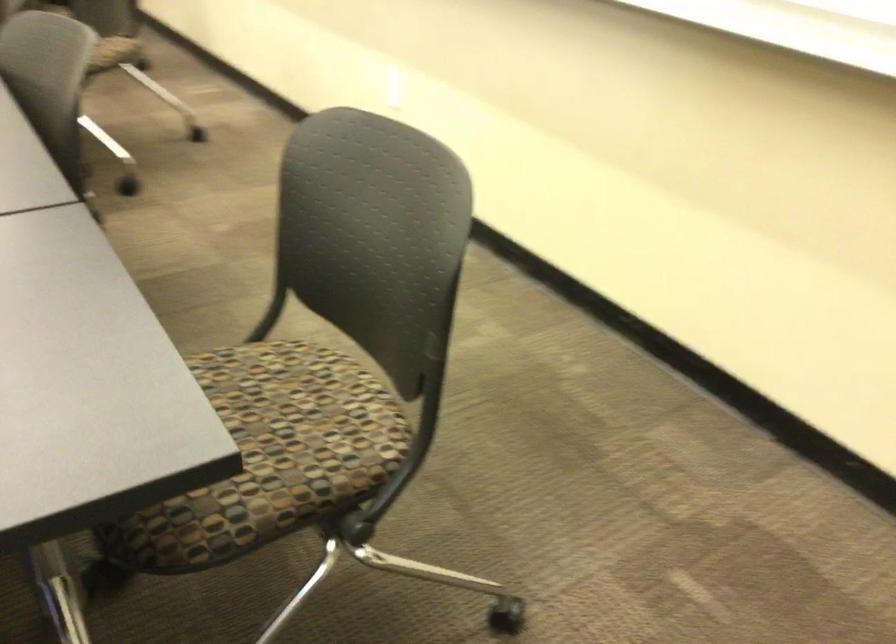
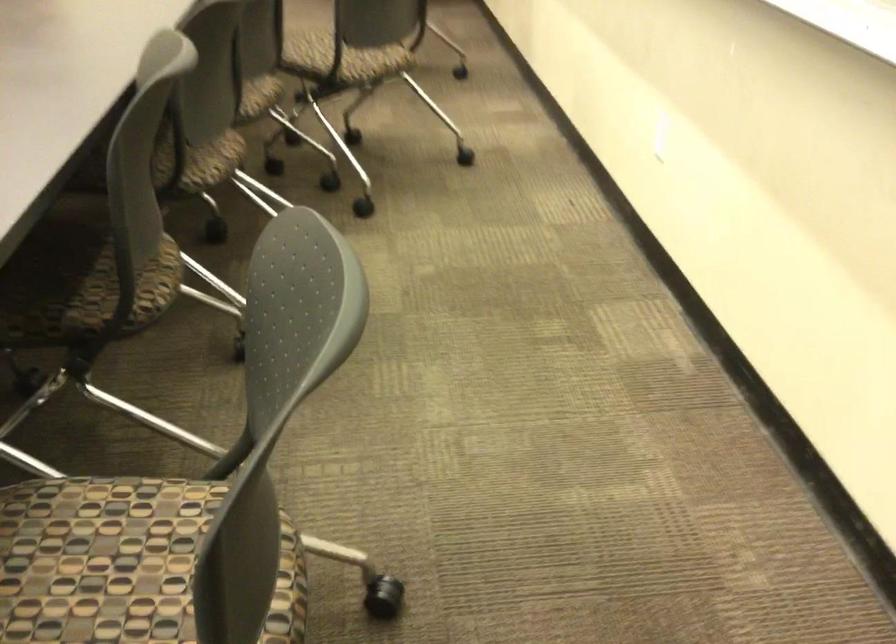
Based on the photo, what movement of the cameraman would produce the second image?

The cameraman walked toward right, forward.